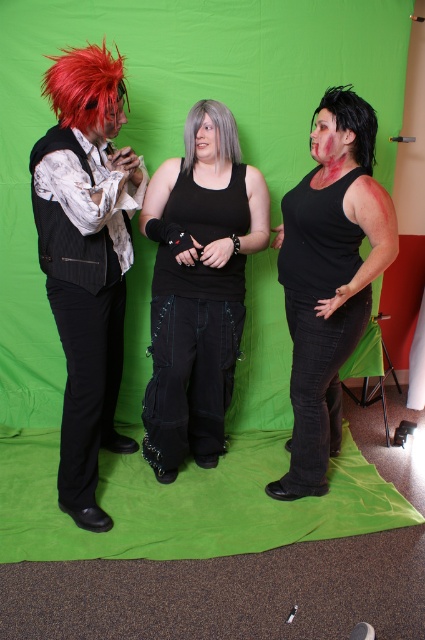
Which is above, shiny black vest at left or black matte tank top at center?

shiny black vest at left is higher up.

Can you confirm if shiny black vest at left is wider than black matte tank top at center?

In fact, shiny black vest at left might be narrower than black matte tank top at center.

Locate an element on the screen. This screenshot has height=640, width=425. shiny black vest at left is located at coordinates (85, 259).

Who is shorter, black matte hair at center or gray matte wig at center?

Standing shorter between the two is gray matte wig at center.

Does black matte hair at center appear under gray matte wig at center?

Correct, black matte hair at center is located below gray matte wig at center.

This screenshot has width=425, height=640. Describe the element at coordinates (351, 122) in the screenshot. I see `black matte hair at center` at that location.

The image size is (425, 640). Identify the location of black matte hair at center. (351, 122).

Who is shorter, black matte tank top at center or gray matte wig at center?

With less height is gray matte wig at center.

Can you confirm if black matte tank top at center is bigger than gray matte wig at center?

Yes, black matte tank top at center is bigger than gray matte wig at center.

The width and height of the screenshot is (425, 640). What do you see at coordinates (198, 285) in the screenshot?
I see `black matte tank top at center` at bounding box center [198, 285].

The image size is (425, 640). Find the location of `black matte tank top at center`. black matte tank top at center is located at coordinates (198, 285).